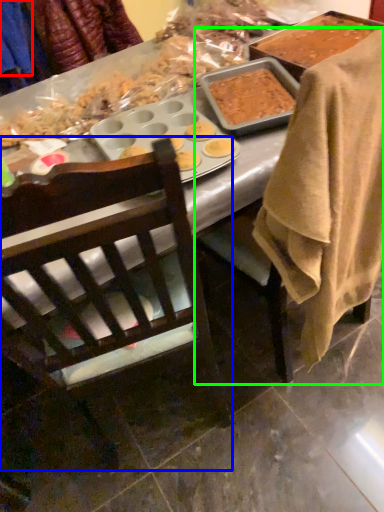
Question: Which object is positioned farthest from clothing (highlighted by a red box)? Select from chair (highlighted by a blue box) and chair (highlighted by a green box).

Choices:
 (A) chair
 (B) chair

Answer: (A)